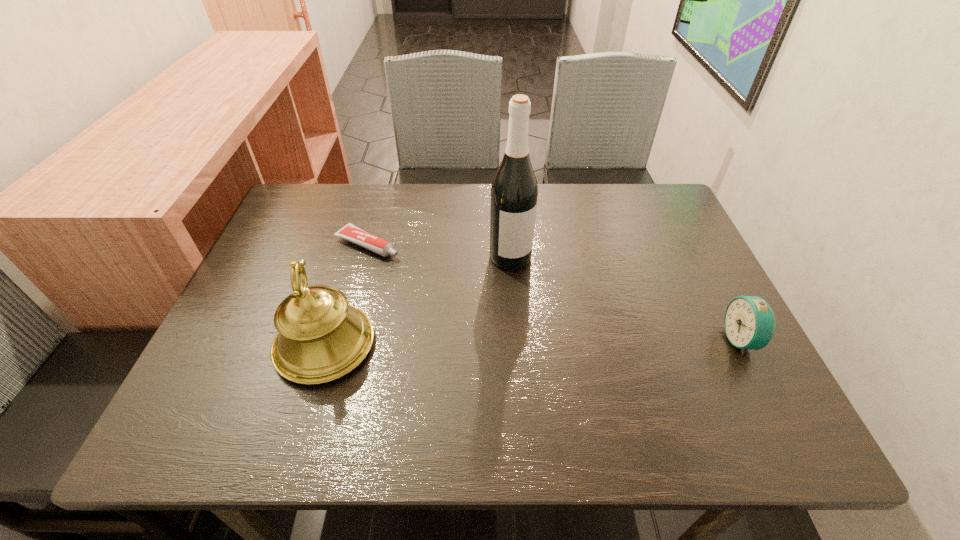
At what (x,y) coordinates should I click in order to perform the action: click on the second tallest object. Please return your answer as a coordinate pair (x, y). The height and width of the screenshot is (540, 960). Looking at the image, I should click on (320, 338).

Where is `the second shortest object`? This screenshot has height=540, width=960. the second shortest object is located at coordinates (749, 322).

Image resolution: width=960 pixels, height=540 pixels. In order to click on alarm clock in this screenshot , I will do `click(749, 322)`.

This screenshot has width=960, height=540. Identify the location of the tallest object. (514, 192).

Where is `wine bottle`? wine bottle is located at coordinates (514, 192).

Identify the location of toothpaste. The image size is (960, 540). (349, 232).

The image size is (960, 540). In order to click on free region located on the right of the second tallest object in this screenshot , I will do `click(520, 345)`.

At what (x,y) coordinates should I click in order to perform the action: click on free region located 0.260m on the front-facing side of the rightmost object. Please return your answer as a coordinate pair (x, y). The height and width of the screenshot is (540, 960). Looking at the image, I should click on (604, 340).

The width and height of the screenshot is (960, 540). Find the location of `vacant point located on the front-facing side of the rightmost object`. vacant point located on the front-facing side of the rightmost object is located at coordinates (599, 340).

Where is `blank space located 0.180m on the front-facing side of the rightmost object`? blank space located 0.180m on the front-facing side of the rightmost object is located at coordinates (641, 340).